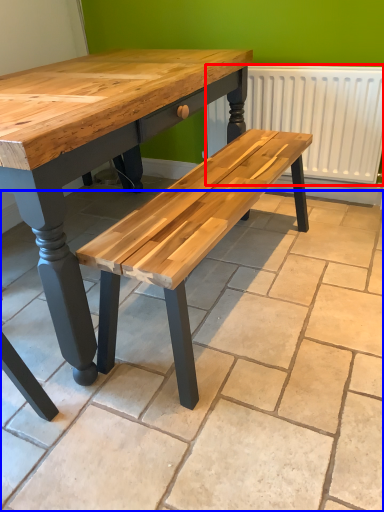
Question: Which object appears closest to the camera in this image, radiator (highlighted by a red box) or tile (highlighted by a blue box)?

Choices:
 (A) radiator
 (B) tile

Answer: (B)